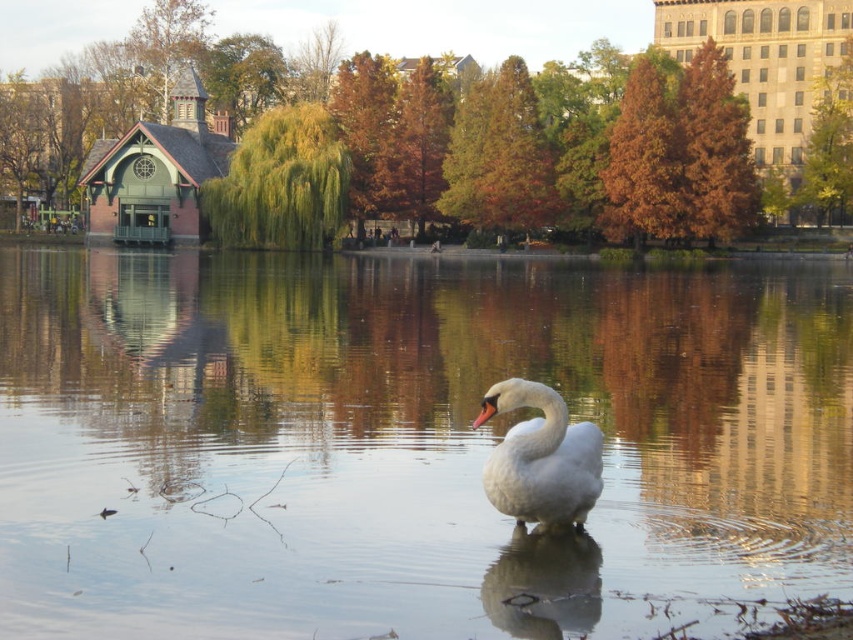
Does clear water at center have a greater height compared to white glossy swan at center?

Yes, clear water at center is taller than white glossy swan at center.

Which of these two, clear water at center or white glossy swan at center, stands shorter?

With less height is white glossy swan at center.

Is point (610, 276) positioned behind point (490, 416)?

That is True.

Where is `clear water at center`? Image resolution: width=853 pixels, height=640 pixels. clear water at center is located at coordinates (405, 442).